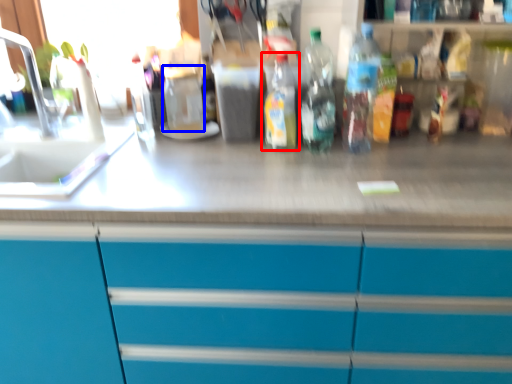
Question: Which point is closer to the camera, bottle (highlighted by a red box) or beverage (highlighted by a blue box)?

Choices:
 (A) bottle
 (B) beverage

Answer: (A)